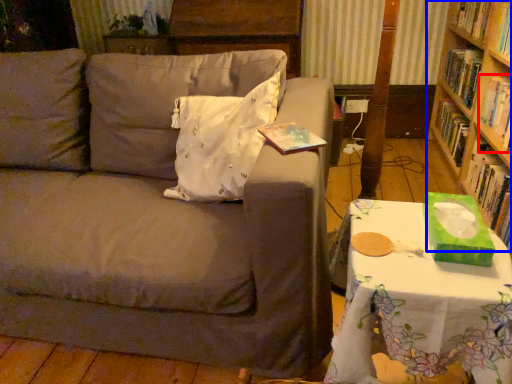
Question: Which object is closer to the camera taking this photo, book (highlighted by a red box) or bookcase (highlighted by a blue box)?

Choices:
 (A) book
 (B) bookcase

Answer: (B)